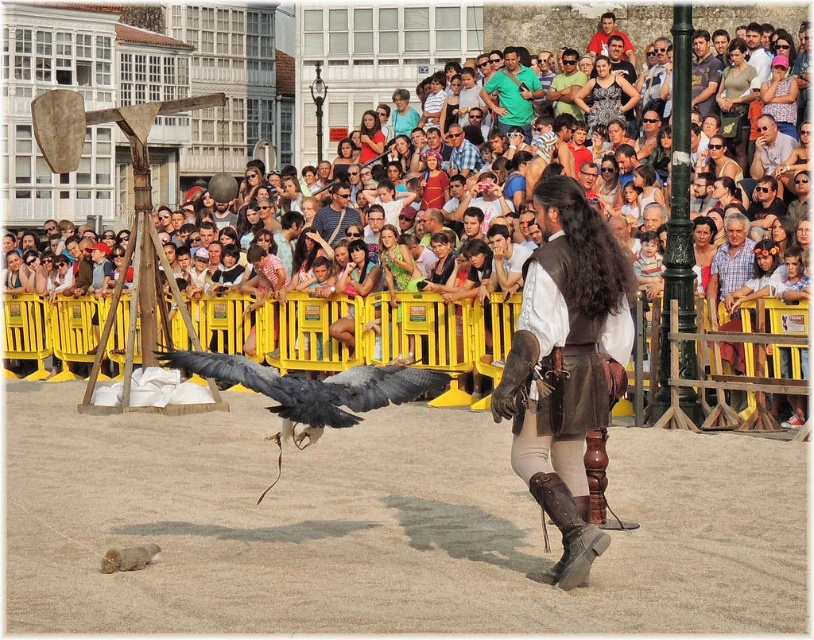
You are standing in the outdoor scene and need to locate the green cotton shirt at upper center. Based on the coordinates provided, where exactly would you look to find it?

The green cotton shirt at upper center is located at point coordinates 0.147 along the horizontal axis and 0.630 along the vertical axis.

You are organizing a costume party and need to decide which shirt to wear. You have the green cotton shirt at upper center and the matte black shirt at center. Which shirt is larger?

The green cotton shirt at upper center is bigger than the matte black shirt at center according to the description.